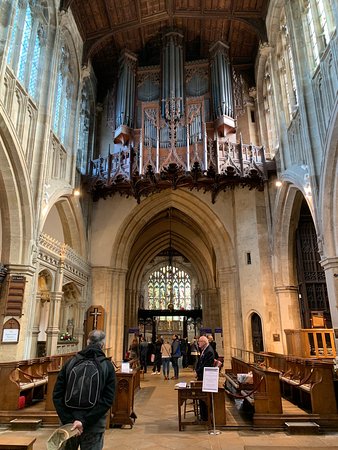
Find the location of a particular element. This screenshot has width=338, height=450. stain glass is located at coordinates (185, 298), (154, 296).